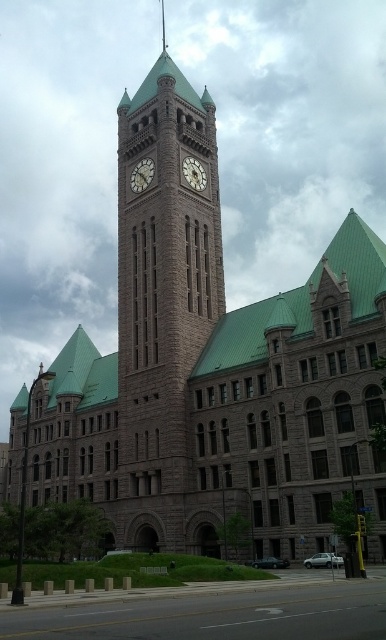
Question: Is matte brown clock at center bigger than gold-toned metal clock at upper center?

Choices:
 (A) yes
 (B) no

Answer: (B)

Question: Based on their relative distances, which object is nearer to the brown stone clock tower at center?

Choices:
 (A) gold-toned metal clock at upper center
 (B) matte brown clock at center

Answer: (B)

Question: Can you confirm if matte brown clock at center is positioned to the right of gold-toned metal clock at upper center?

Choices:
 (A) yes
 (B) no

Answer: (B)

Question: Which object is closer to the camera taking this photo?

Choices:
 (A) gold-toned metal clock at upper center
 (B) brown stone clock tower at center
 (C) matte brown clock at center

Answer: (B)

Question: Is brown stone clock tower at center below gold-toned metal clock at upper center?

Choices:
 (A) no
 (B) yes

Answer: (A)

Question: Which object is the farthest from the matte brown clock at center?

Choices:
 (A) brown stone clock tower at center
 (B) gold-toned metal clock at upper center

Answer: (A)